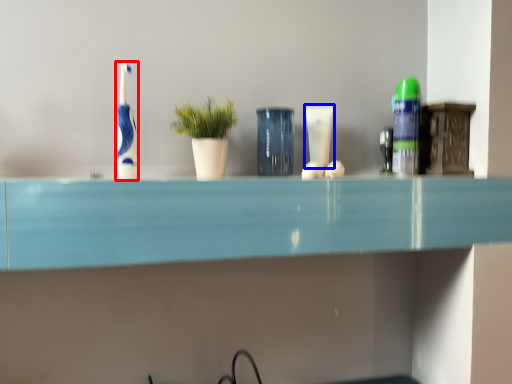
Question: Which point is closer to the camera, toothbrush (highlighted by a red box) or toiletry (highlighted by a blue box)?

Choices:
 (A) toothbrush
 (B) toiletry

Answer: (A)